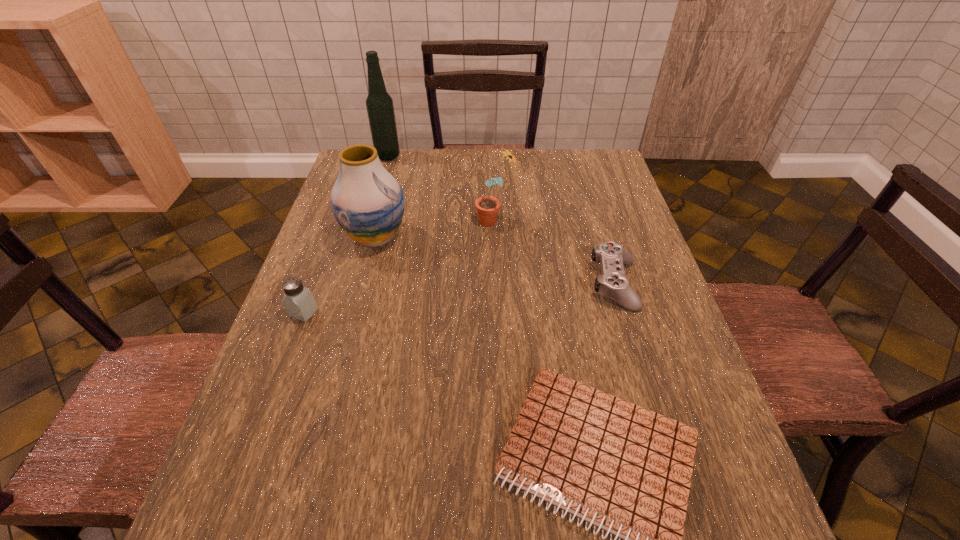
This screenshot has height=540, width=960. I want to click on vacant space at the left edge of the desktop, so click(x=357, y=258).

Locate an element on the screen. vacant space at the right edge is located at coordinates (620, 224).

Identify the location of free space between the tallest object and the saltshaker. (346, 234).

The width and height of the screenshot is (960, 540). Find the location of `free point between the second shortest object and the sunflower`. free point between the second shortest object and the sunflower is located at coordinates (555, 252).

Identify the location of vacant area that lies between the sunflower and the tallest object. This screenshot has width=960, height=540. tap(442, 188).

This screenshot has width=960, height=540. What are the coordinates of `free space that is in between the third shortest object and the sunflower` in the screenshot? It's located at (399, 266).

Locate an element on the screen. The height and width of the screenshot is (540, 960). vacant space that's between the sunflower and the alcohol is located at coordinates (442, 188).

This screenshot has height=540, width=960. Identify the location of the second closest object relative to the third shortest object. (627, 470).

Locate an element on the screen. Image resolution: width=960 pixels, height=540 pixels. object that can be found as the fourth closest to the farthest object is located at coordinates [613, 284].

Where is `vacant space that satisfies the following two spatial constraints: 1. on the flower of the sunflower; 2. on the front side of the vase`? Image resolution: width=960 pixels, height=540 pixels. vacant space that satisfies the following two spatial constraints: 1. on the flower of the sunflower; 2. on the front side of the vase is located at coordinates (495, 237).